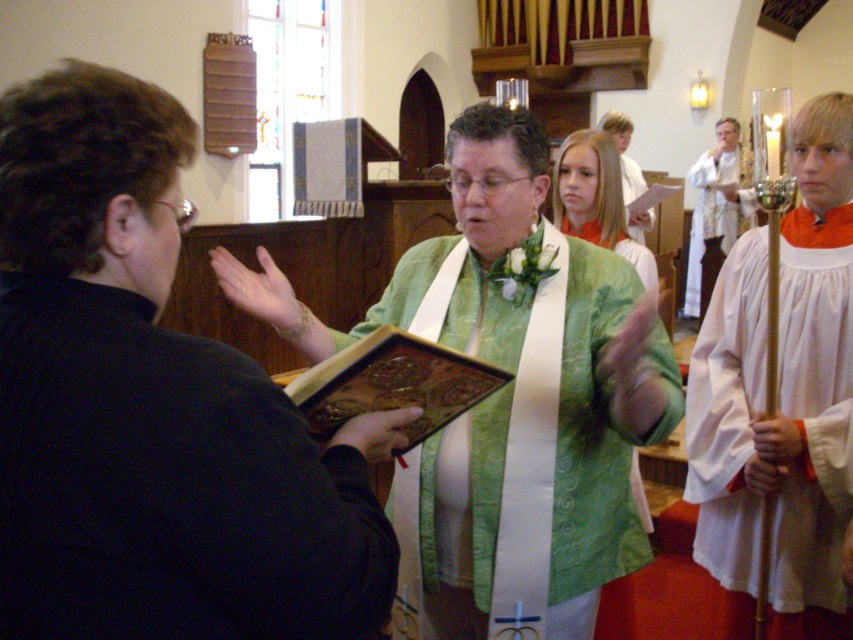
Is point (799, 320) in front of point (582, 468)?

No, (799, 320) is further to viewer.

Which is in front, point (732, 372) or point (457, 314)?

Positioned in front is point (457, 314).

This screenshot has height=640, width=853. Find the location of `white cotton robe at right`. white cotton robe at right is located at coordinates (813, 410).

Is point (689, 180) positioned behind point (639, 220)?

That is True.

Is point (728, 196) in front of point (627, 129)?

No, it is not.

Where is `white silk robe at upper right`? The height and width of the screenshot is (640, 853). white silk robe at upper right is located at coordinates (717, 209).

Does point (606, 161) come closer to viewer compared to point (653, 216)?

Yes, point (606, 161) is closer to viewer.

Who is more forward, (651,529) or (619,161)?

Point (651,529) is in front.

The height and width of the screenshot is (640, 853). What do you see at coordinates (596, 200) in the screenshot?
I see `green textured vest at center` at bounding box center [596, 200].

Locate an element on the screen. This screenshot has height=640, width=853. green textured vest at center is located at coordinates (596, 200).